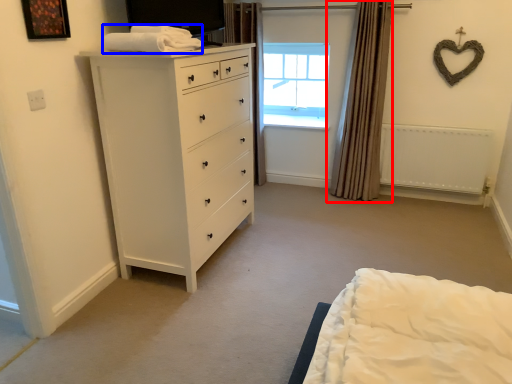
Question: Among these objects, which one is nearest to the camera, curtain (highlighted by a red box) or blanket (highlighted by a blue box)?

Choices:
 (A) curtain
 (B) blanket

Answer: (B)